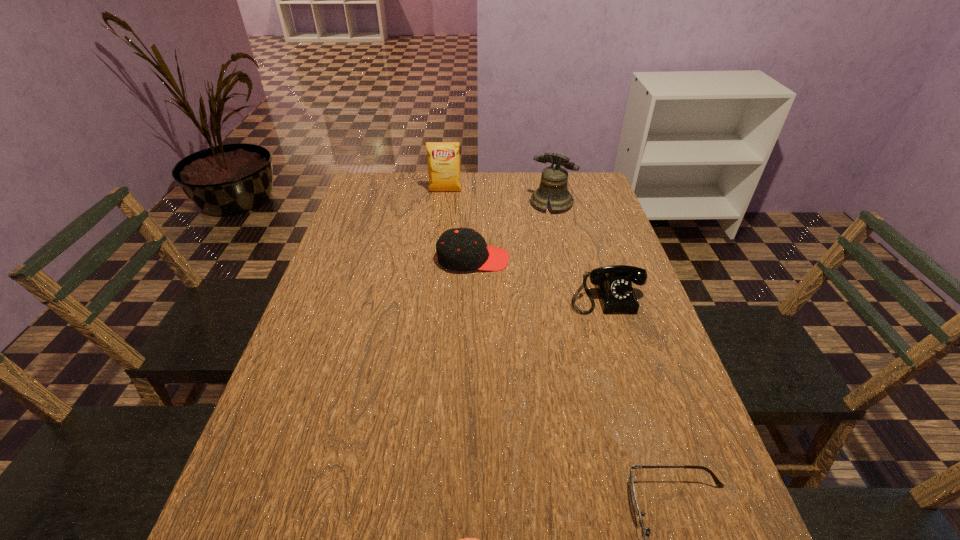
Identify the location of crisp (potato chip). The image size is (960, 540). (443, 158).

The image size is (960, 540). I want to click on bell, so click(554, 178).

Image resolution: width=960 pixels, height=540 pixels. I want to click on cap, so click(x=459, y=249).

Where is `telephone`? This screenshot has height=540, width=960. telephone is located at coordinates (613, 283).

Locate an element on the screen. Image resolution: width=960 pixels, height=540 pixels. free spot located 0.100m on the front of the crisp (potato chip) with the logo is located at coordinates (444, 210).

What are the coordinates of `vacant space located 0.100m on the left of the bell` in the screenshot? It's located at (500, 204).

Find the location of a particular element. The image size is (960, 540). vacant region located on the front-facing side of the cap is located at coordinates (612, 259).

Locate an element on the screen. Image resolution: width=960 pixels, height=540 pixels. free location located on the dial of the telephone is located at coordinates (647, 430).

What are the coordinates of `crisp (potato chip) at the far edge` in the screenshot? It's located at (443, 158).

This screenshot has height=540, width=960. Identify the location of bell that is at the far edge. (554, 178).